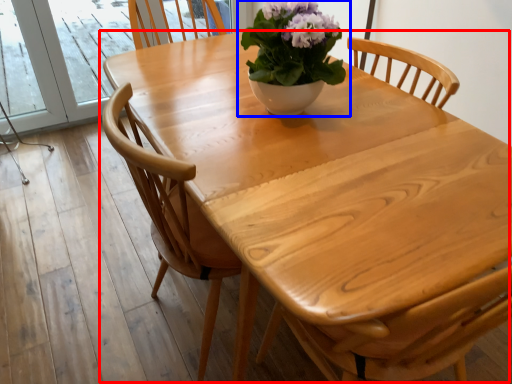
Question: Which point is closer to the camera, kitchen & dining room table (highlighted by a red box) or houseplant (highlighted by a blue box)?

Choices:
 (A) kitchen & dining room table
 (B) houseplant

Answer: (A)